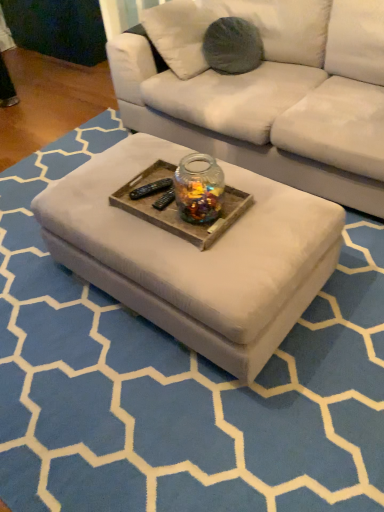
Locate an element on the screen. free region on the left part of transparent glass jar at center is located at coordinates tap(152, 206).